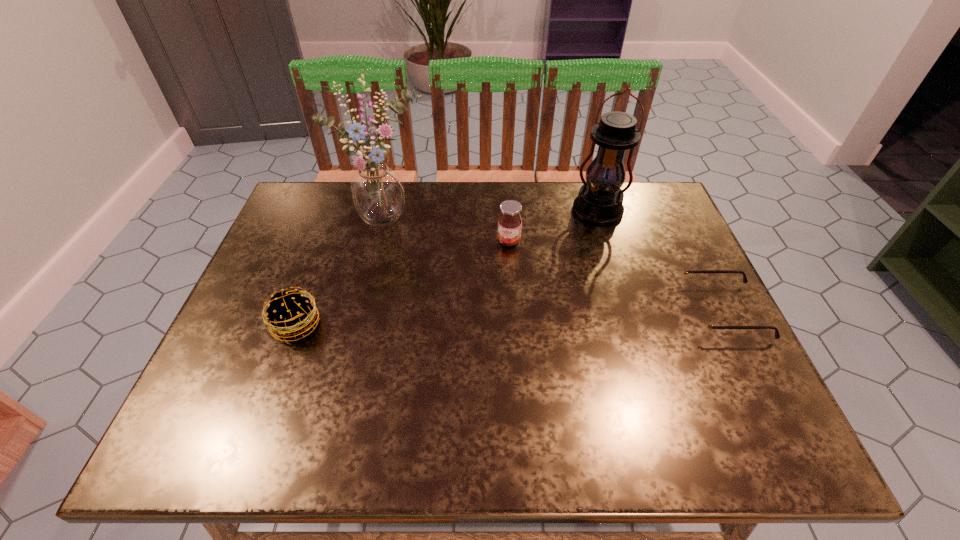
At what (x,y) coordinates should I click in order to perform the action: click on vacant region located 0.150m at the hinge ends of the rightmost object. Please return your answer as a coordinate pair (x, y). Looking at the image, I should click on (622, 312).

Identify the location of free point located 0.340m at the hinge ends of the rightmost object. (541, 312).

Locate the blank area located 0.340m above the fourth shortest object, indicating its light source in the image. Please provide its 2D coordinates. Your answer should be formatted as a tuple, i.e. [(x, y)], where the tuple contains the x and y coordinates of a point satisfying the conditions above.

[(555, 310)]

Choose a point located 0.120m above the fourth shortest object, indicating its light source in the vacant region. Please provide its 2D coordinates. Your answer should be formatted as a tuple, i.e. [(x, y)], where the tuple contains the x and y coordinates of a point satisfying the conditions above.

[(580, 253)]

Locate several points within vacant space located above the fourth shortest object, indicating its light source. Please provide its 2D coordinates. Your answer should be formatted as a tuple, i.e. [(x, y)], where the tuple contains the x and y coordinates of a point satisfying the conditions above.

[(566, 285)]

Image resolution: width=960 pixels, height=540 pixels. Find the location of `vacant area situated on the label side of the third object from right to left`. vacant area situated on the label side of the third object from right to left is located at coordinates (480, 328).

Where is `free space located 0.340m on the label side of the third object from right to left`? The image size is (960, 540). free space located 0.340m on the label side of the third object from right to left is located at coordinates (473, 349).

Locate an element on the screen. vacant region located on the label side of the third object from right to left is located at coordinates (487, 309).

This screenshot has height=540, width=960. What are the coordinates of `free space located 0.230m on the front-facing side of the bouquet` in the screenshot? It's located at (444, 286).

Identify the location of free space located on the front-facing side of the bouquet. (438, 279).